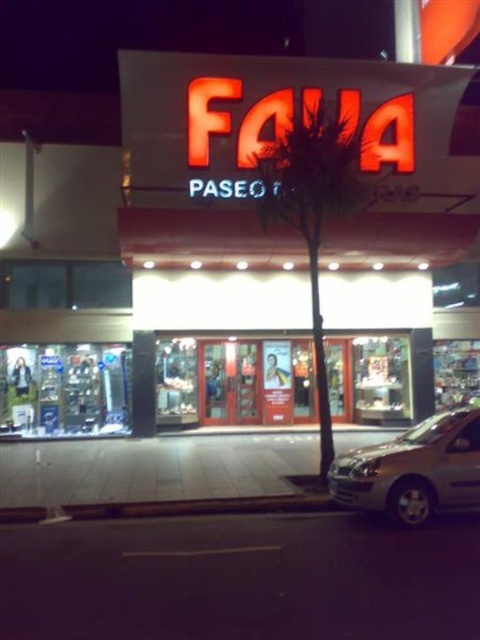
Question: Is glass door entrance at center below silver metallic car at lower right?

Choices:
 (A) no
 (B) yes

Answer: (B)

Question: Can you confirm if glass door entrance at center is positioned to the left of silver metallic car at lower right?

Choices:
 (A) yes
 (B) no

Answer: (A)

Question: Does glass door entrance at center appear on the left side of silver metallic car at lower right?

Choices:
 (A) yes
 (B) no

Answer: (A)